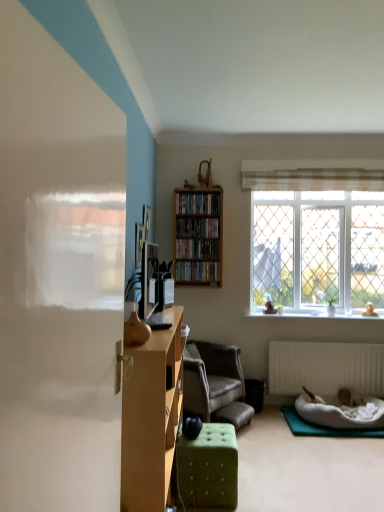
Measure the distance between green leafy plant at window and camera.

The depth of green leafy plant at window is 4.51 meters.

The width and height of the screenshot is (384, 512). What do you see at coordinates (328, 298) in the screenshot? I see `green leafy plant at window` at bounding box center [328, 298].

What is the approximate width of white plush pet bed at lower right?

white plush pet bed at lower right is 23.45 inches in width.

The image size is (384, 512). What do you see at coordinates (341, 411) in the screenshot?
I see `white plush pet bed at lower right` at bounding box center [341, 411].

This screenshot has width=384, height=512. Describe the element at coordinates (324, 426) in the screenshot. I see `green felt yoga mat at lower right` at that location.

In order to face wooden shelf at center, the fourth book positioned from the bottom, should I rotate leftwards or rightwards?

Turn right approximately 1.227 degrees to face it.

Where is `wooden cabinet at center-left`? Image resolution: width=384 pixels, height=512 pixels. wooden cabinet at center-left is located at coordinates (151, 418).

You are a GUI agent. You are given a task and a screenshot of the screen. Output one action in this format:
    pyautogui.click(x=<x>, y=<y>)
    Task: Click on the green leafy plant at window
    The image size is (384, 512).
    Given the screenshot: What is the action you would take?
    pyautogui.click(x=328, y=298)

Looking at this image, from the image's perspective, which object appears higher, wooden shelf at center, the fourth book positioned from the bottom, or green fabric ottoman at lower center?

From the image's view, wooden shelf at center, the fourth book positioned from the bottom, is above.

Between wooden shelf at center, the fourth book positioned from the bottom, and green fabric ottoman at lower center, which one has less height?

wooden shelf at center, the fourth book positioned from the bottom.

From a real-world perspective, who is located lower, wooden shelf at center, arranged as the first book when viewed from the top, or green fabric ottoman at lower center?

In real-world perspective, green fabric ottoman at lower center is lower.

From a real-world perspective, which object stands above the other?

In real-world perspective, wooden bookshelf at center is above.

Considering the sizes of objects wooden bookshelf at center, which is counted as the fourth book, starting from the top, and wooden bookshelf at center in the image provided, who is wider, wooden bookshelf at center, which is counted as the fourth book, starting from the top, or wooden bookshelf at center?

wooden bookshelf at center, which is counted as the fourth book, starting from the top, is wider.

Is wooden bookshelf at center, which is counted as the fourth book, starting from the top, smaller than wooden bookshelf at center?

Yes, wooden bookshelf at center, which is counted as the fourth book, starting from the top, is smaller than wooden bookshelf at center.

Can you confirm if wooden bookshelf at center, which is counted as the fourth book, starting from the top, is shorter than wooden bookshelf at center?

Yes, wooden bookshelf at center, which is counted as the fourth book, starting from the top, is shorter than wooden bookshelf at center.

In the scene shown: From a real-world perspective, relative to white plastic radiator at lower right, is wooden shelf at upper center, the 3th book from the bottom, vertically above or below?

wooden shelf at upper center, the 3th book from the bottom, is above white plastic radiator at lower right.

Does wooden shelf at upper center, the 3th book from the bottom, have a greater height compared to white plastic radiator at lower right?

No, wooden shelf at upper center, the 3th book from the bottom, is not taller than white plastic radiator at lower right.

Between wooden shelf at upper center, the 3th book from the bottom, and white plastic radiator at lower right, which one has smaller width?

white plastic radiator at lower right is thinner.

From the image's perspective, is wooden shelf at upper center, the second book from the top, located above or below white plastic radiator at lower right?

Clearly, from the image's perspective, wooden shelf at upper center, the second book from the top, is above white plastic radiator at lower right.

Between green fabric ottoman at lower center and leather-like brown armchair at center, which one has more height?

leather-like brown armchair at center.

Can you tell me how much green fabric ottoman at lower center and leather-like brown armchair at center differ in facing direction?

37.3 degrees.

From a real-world perspective, who is located higher, green fabric ottoman at lower center or leather-like brown armchair at center?

leather-like brown armchair at center.

Considering the relative sizes of green fabric ottoman at lower center and leather-like brown armchair at center in the image provided, is green fabric ottoman at lower center thinner than leather-like brown armchair at center?

Yes, green fabric ottoman at lower center is thinner than leather-like brown armchair at center.

In terms of size, does wooden cabinet at center-left appear bigger or smaller than green felt yoga mat at lower right?

wooden cabinet at center-left is bigger than green felt yoga mat at lower right.

Is wooden cabinet at center-left positioned before green felt yoga mat at lower right?

Yes, wooden cabinet at center-left is closer to the viewer.

Find the location of a particular element. This screenshot has width=384, height=512. cabinetry in front of the green felt yoga mat at lower right is located at coordinates (151, 418).

Consider the image. Does wooden cabinet at center-left turn towards green felt yoga mat at lower right?

Yes, wooden cabinet at center-left is turned towards green felt yoga mat at lower right.

Looking at this image, which object is further away from the camera taking this photo, green fabric ottoman at lower center or wooden shelf at upper center, the second book from the top?

wooden shelf at upper center, the second book from the top, is behind.

Identify the location of ottoman in front of the wooden shelf at upper center, the second book from the top. (209, 467).

From a real-world perspective, is green fabric ottoman at lower center below wooden shelf at upper center, the 3th book from the bottom?

Yes, from a real-world perspective, green fabric ottoman at lower center is below wooden shelf at upper center, the 3th book from the bottom.

How many degrees apart are the facing directions of green fabric ottoman at lower center and wooden shelf at upper center, the second book from the top?

94.7 degrees.

From a real-world perspective, who is located lower, green felt yoga mat at lower right or leather-like brown armchair at center?

green felt yoga mat at lower right is physically lower.

Between green felt yoga mat at lower right and leather-like brown armchair at center, which one appears on the left side from the viewer's perspective?

Positioned to the left is leather-like brown armchair at center.

How many degrees apart are the facing directions of green felt yoga mat at lower right and leather-like brown armchair at center?

green felt yoga mat at lower right and leather-like brown armchair at center are facing 54.2 degrees away from each other.

From the image's perspective, is green felt yoga mat at lower right above or below leather-like brown armchair at center?

Clearly, from the image's perspective, green felt yoga mat at lower right is below leather-like brown armchair at center.

This screenshot has height=512, width=384. What are the coordinates of `ottoman that is on the right side of wooden shelf at center, the fourth book positioned from the bottom` in the screenshot? It's located at (209, 467).

The image size is (384, 512). What are the coordinates of `the 2nd book below the wooden bookshelf at center (from the image's perspective)` in the screenshot? It's located at (197, 271).

Estimate the real-world distances between objects in this image. Which object is closer to green fabric ottoman at lower center, white plush pet bed at lower right or matte brown vase at center?

The object closer to green fabric ottoman at lower center is matte brown vase at center.

Looking at the image, which one is located further to clear glass window at upper right, wooden shelf at center, arranged as the first book when viewed from the top, or white plush pet bed at lower right?

Based on the image, white plush pet bed at lower right appears to be further to clear glass window at upper right.

From the image, which object appears to be farther from black matte speaker at lower center, white plush pet bed at lower right or wooden shelf at upper center, the second book from the top?

Among the two, wooden shelf at upper center, the second book from the top, is located further to black matte speaker at lower center.

Which object lies nearer to the anchor point leather-like brown armchair at center, wooden bookshelf at center or black matte speaker at lower center?

The object closer to leather-like brown armchair at center is black matte speaker at lower center.

When comparing their distances from clear glass window at upper right, does wooden bookshelf at center, which is counted as the fourth book, starting from the top, or wooden cabinet at center-left seem further?

The object further to clear glass window at upper right is wooden cabinet at center-left.

Estimate the real-world distances between objects in this image. Which object is further from wooden shelf at center, the fourth book positioned from the bottom, leather-like brown armchair at center or green leafy plant at window?

Among the two, leather-like brown armchair at center is located further to wooden shelf at center, the fourth book positioned from the bottom.

Estimate the real-world distances between objects in this image. Which object is further from wooden shelf at upper center, the 3th book from the bottom, green leafy plant at window or wooden bookshelf at center, which is counted as the fourth book, starting from the top?

green leafy plant at window lies further to wooden shelf at upper center, the 3th book from the bottom, than the other object.

Looking at the image, which one is located further to white plastic radiator at lower right, wooden bookshelf at center or leather-like brown armchair at center?

The object further to white plastic radiator at lower right is wooden bookshelf at center.

Identify the location of footrest between wooden cabinet at center-left and black matte speaker at lower center along the z-axis. This screenshot has height=512, width=384. (234, 414).

The height and width of the screenshot is (512, 384). I want to click on the footrest positioned between wooden cabinet at center-left and wooden bookshelf at center from near to far, so click(234, 414).

This screenshot has width=384, height=512. Find the location of `yoga mat located between leather-like brown armchair at center and white plastic radiator at lower right in the left-right direction`. yoga mat located between leather-like brown armchair at center and white plastic radiator at lower right in the left-right direction is located at coordinates (324, 426).

Where is `yoga mat between green fabric ottoman at lower center and black matte speaker at lower center in the front-back direction`? yoga mat between green fabric ottoman at lower center and black matte speaker at lower center in the front-back direction is located at coordinates (324, 426).